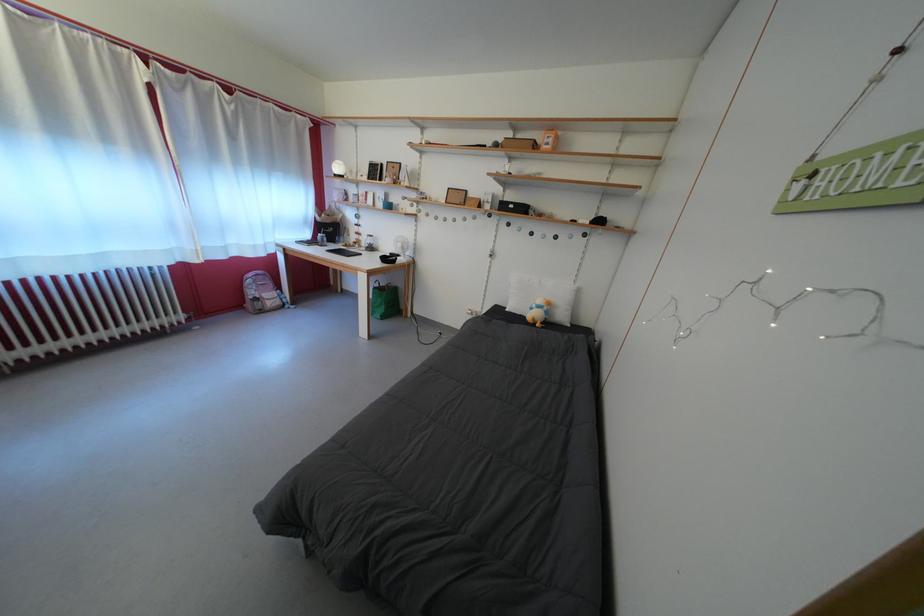
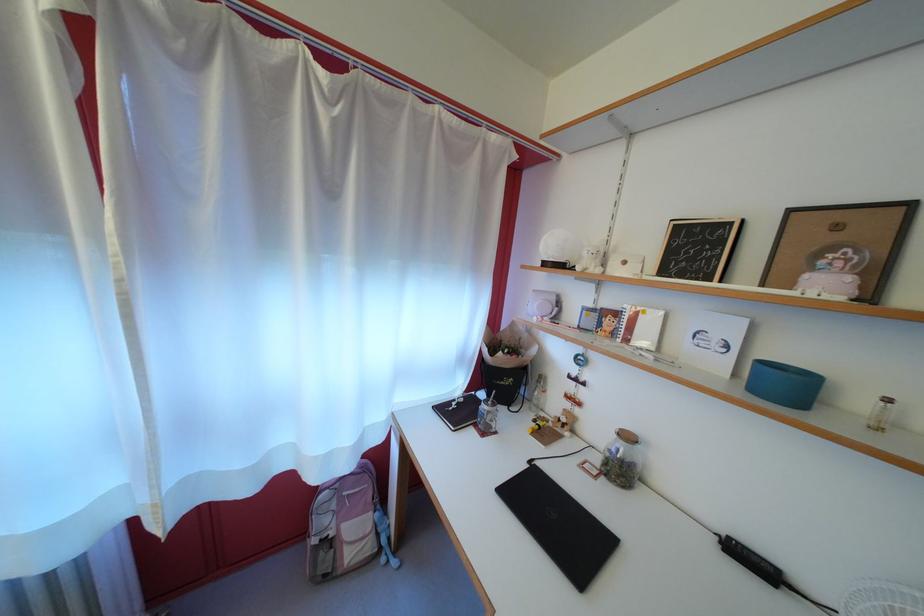
Find the pixel in the second image that matches point 240,142 in the first image.

(335, 193)